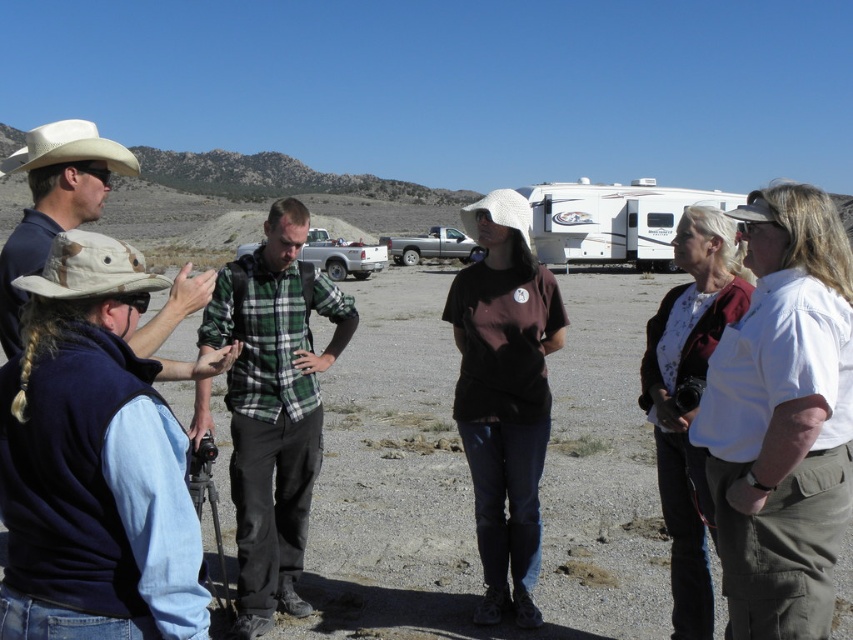
Who is taller, white cotton shirt at right or white felt cowboy hat at left?

white felt cowboy hat at left is taller.

Between point (706, 376) and point (135, 173), which one is positioned in front?

Point (706, 376) is in front.

This screenshot has height=640, width=853. What are the coordinates of `white cotton shirt at right` in the screenshot? It's located at (782, 422).

Which is more to the right, camouflage fabric cowboy hat at left or white felt cowboy hat at left?

camouflage fabric cowboy hat at left

Is camouflage fabric cowboy hat at left bigger than white felt cowboy hat at left?

Actually, camouflage fabric cowboy hat at left might be smaller than white felt cowboy hat at left.

Locate an element on the screen. camouflage fabric cowboy hat at left is located at coordinates (90, 268).

At what (x,y) coordinates should I click in order to perform the action: click on white felt cowboy hat at left. Please return your answer as a coordinate pair (x, y). This screenshot has width=853, height=640. Looking at the image, I should click on (68, 148).

Is white felt cowboy hat at left shorter than silver metallic truck at center?

Correct, white felt cowboy hat at left is not as tall as silver metallic truck at center.

Is point (113, 157) farther from camera compared to point (459, 236)?

No, it is not.

What are the coordinates of `white felt cowboy hat at left` in the screenshot? It's located at (68, 148).